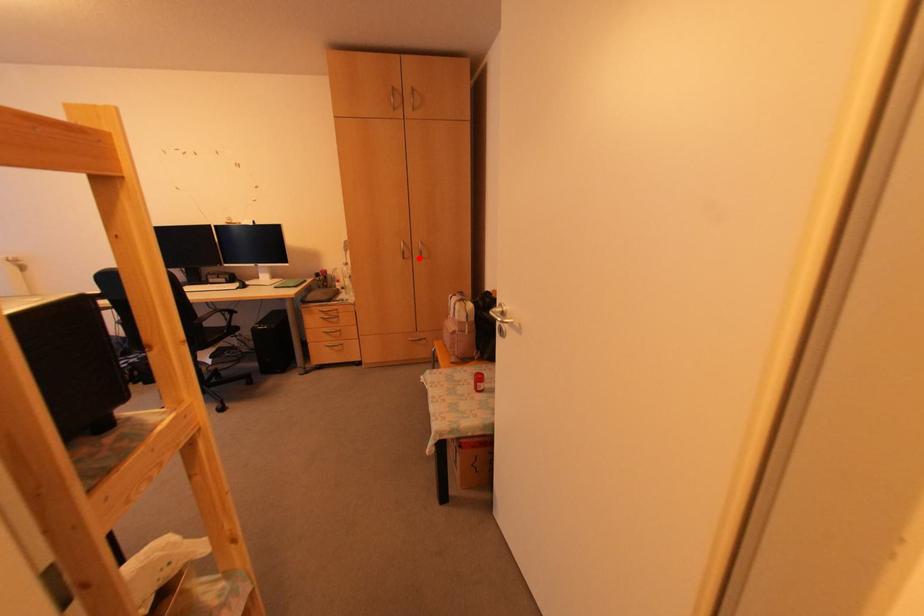
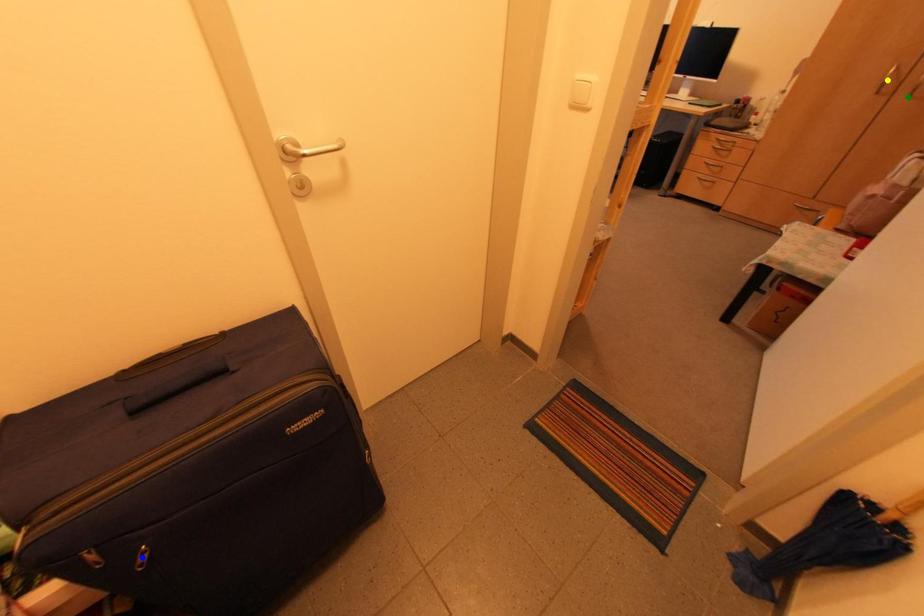
Question: I am providing you with two images of the same scene from different viewpoints. A red point is marked on the first image. You are given multiple points on the second image. Can you choose the point in image 2 that corresponds to the point in image 1?

Choices:
 (A) blue point
 (B) yellow point
 (C) green point

Answer: (C)